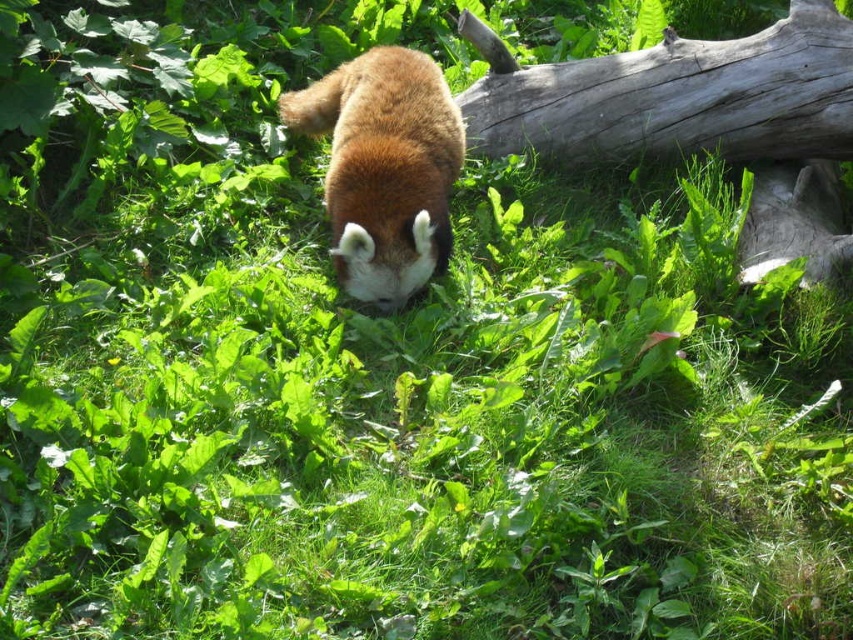
Is point (817, 38) more distant than point (399, 257)?

Yes, point (817, 38) is behind point (399, 257).

Measure the distance between gray rough wood at upper right and camera.

The distance of gray rough wood at upper right from camera is 11.40 feet.

The image size is (853, 640). I want to click on gray rough wood at upper right, so click(x=672, y=96).

Where is `gray rough wood at upper right`? Image resolution: width=853 pixels, height=640 pixels. gray rough wood at upper right is located at coordinates (672, 96).